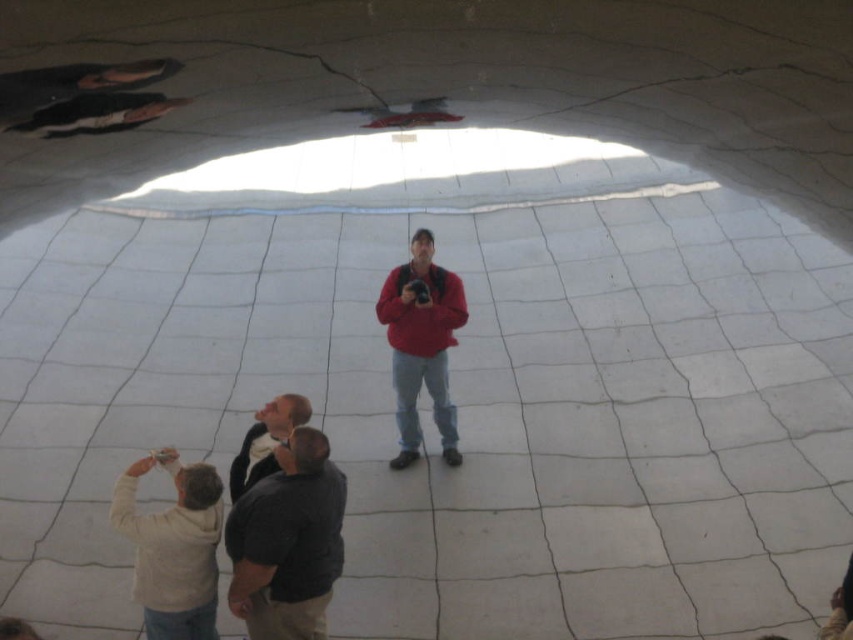
Between dark gray fabric at lower center and beige sweater at lower left, which one has more height?

With more height is dark gray fabric at lower center.

Is point (270, 637) positioned before point (126, 508)?

Yes, it is in front of point (126, 508).

Identify the location of dark gray fabric at lower center. (287, 541).

Who is more forward, (293, 593) or (283, 428)?

Positioned in front is point (293, 593).

Can you confirm if dark gray fabric at lower center is smaller than dark gray sweater at lower center?

Actually, dark gray fabric at lower center might be larger than dark gray sweater at lower center.

At what (x,y) coordinates should I click in order to perform the action: click on dark gray fabric at lower center. Please return your answer as a coordinate pair (x, y). The image size is (853, 640). Looking at the image, I should click on (287, 541).

Identify the location of dark gray fabric at lower center. (287, 541).

How distant is matte red jacket at center from dark gray sweater at lower center?

5.24 feet

Between matte red jacket at center and dark gray sweater at lower center, which one has more height?

matte red jacket at center

Is point (442, 275) closer to camera compared to point (234, 490)?

No, it is behind (234, 490).

Locate an element on the screen. The height and width of the screenshot is (640, 853). matte red jacket at center is located at coordinates (421, 344).